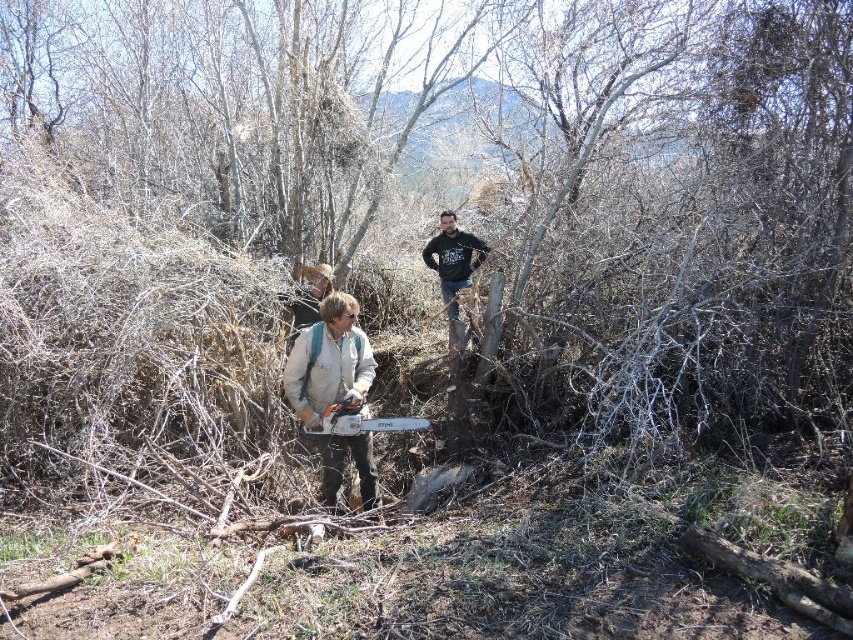
Can you confirm if black cotton sweatshirt at upper center is wider than metallic gray chainsaw at center?

No.

Is the position of black cotton sweatshirt at upper center more distant than that of metallic gray chainsaw at center?

That is True.

Is point (447, 305) farther from camera compared to point (396, 420)?

That is True.

You are a GUI agent. You are given a task and a screenshot of the screen. Output one action in this format:
    pyautogui.click(x=<x>, y=<y>)
    Task: Click on the black cotton sweatshirt at upper center
    This screenshot has width=853, height=640.
    Given the screenshot: What is the action you would take?
    pyautogui.click(x=453, y=259)

Does light brown leather jacket at center appear on the left side of black cotton sweatshirt at upper center?

Correct, you'll find light brown leather jacket at center to the left of black cotton sweatshirt at upper center.

Based on the photo, which is above, light brown leather jacket at center or black cotton sweatshirt at upper center?

black cotton sweatshirt at upper center is above.

Who is more forward, (351, 317) or (468, 241)?

Point (351, 317) is more forward.

I want to click on light brown leather jacket at center, so click(328, 362).

Is light brown leather jacket at center wider than metallic gray chainsaw at center?

No, light brown leather jacket at center is not wider than metallic gray chainsaw at center.

At what (x,y) coordinates should I click in order to perform the action: click on light brown leather jacket at center. Please return your answer as a coordinate pair (x, y). This screenshot has width=853, height=640. Looking at the image, I should click on (328, 362).